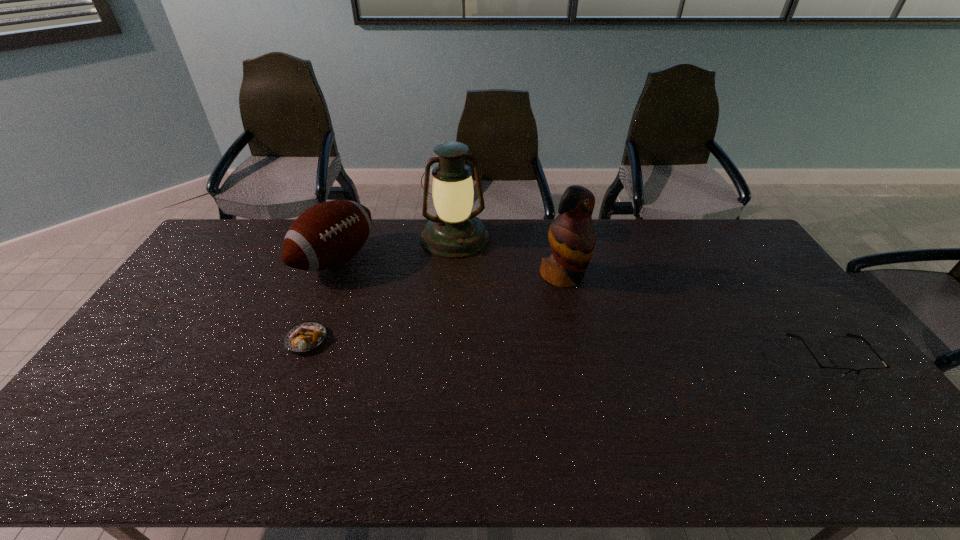
Where is `vacant space located on the face of the second object from right to left`? vacant space located on the face of the second object from right to left is located at coordinates (608, 322).

The height and width of the screenshot is (540, 960). I want to click on blank area located 0.210m on the face of the second object from right to left, so click(619, 334).

This screenshot has width=960, height=540. I want to click on free space located with the light compartment facing forward on the lantern, so click(x=473, y=296).

At what (x,y) coordinates should I click in order to perform the action: click on free region located 0.070m with the light compartment facing forward on the lantern. Please return your answer as a coordinate pair (x, y). Image resolution: width=960 pixels, height=540 pixels. Looking at the image, I should click on (466, 271).

Locate an element on the screen. free region located with the light compartment facing forward on the lantern is located at coordinates (475, 302).

This screenshot has height=540, width=960. Identify the location of football that is at the far edge. (328, 234).

In order to click on lantern at the far edge in this screenshot , I will do `click(455, 232)`.

Where is `object located at the right edge`? This screenshot has width=960, height=540. object located at the right edge is located at coordinates (827, 372).

In order to click on free space at the far edge in this screenshot , I will do `click(597, 247)`.

Where is `free location at the near edge of the desktop`? The image size is (960, 540). free location at the near edge of the desktop is located at coordinates (444, 401).